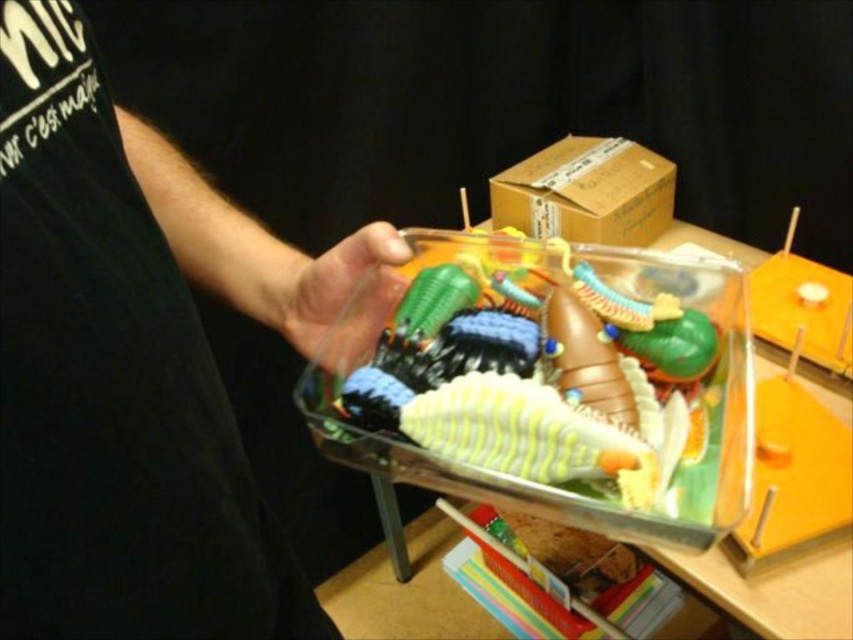
In the scene shown: Does transparent plastic tray at center have a greater width compared to matte plastic hand at center?

Indeed, transparent plastic tray at center has a greater width compared to matte plastic hand at center.

This screenshot has height=640, width=853. Describe the element at coordinates (775, 588) in the screenshot. I see `transparent plastic tray at center` at that location.

Where is `transparent plastic tray at center`? transparent plastic tray at center is located at coordinates (775, 588).

You are a GUI agent. You are given a task and a screenshot of the screen. Output one action in this format:
    pyautogui.click(x=<x>, y=<y>)
    Task: Click on the transparent plastic tray at center
    The height and width of the screenshot is (640, 853).
    Given the screenshot: What is the action you would take?
    pyautogui.click(x=775, y=588)

Between matte plastic toy at upper center and brown cardboard box at upper center, which one has more height?

matte plastic toy at upper center

Is matte plastic toy at upper center thinner than brown cardboard box at upper center?

Indeed, matte plastic toy at upper center has a lesser width compared to brown cardboard box at upper center.

Which is behind, point (90, 76) or point (492, 177)?

The point (492, 177) is more distant.

Locate an element on the screen. matte plastic toy at upper center is located at coordinates (132, 365).

Can you confirm if translucent plastic toy at center is positioned above brown cardboard box at upper center?

Incorrect, translucent plastic toy at center is not positioned above brown cardboard box at upper center.

Is point (697, 365) positioned after point (614, 163)?

That is False.

The image size is (853, 640). Find the location of `translucent plastic toy at center`. translucent plastic toy at center is located at coordinates (552, 364).